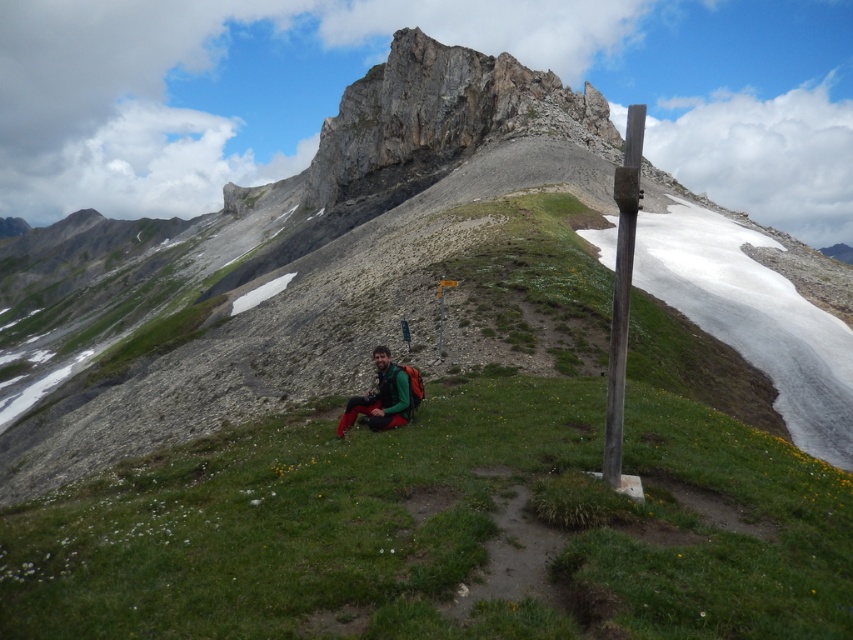
You are a hiker who has just reached a high altitude area. You notice a smooth wooden post at right and a green matte jacket at center. Which object is larger in size?

The smooth wooden post at right is bigger than the green matte jacket at center.